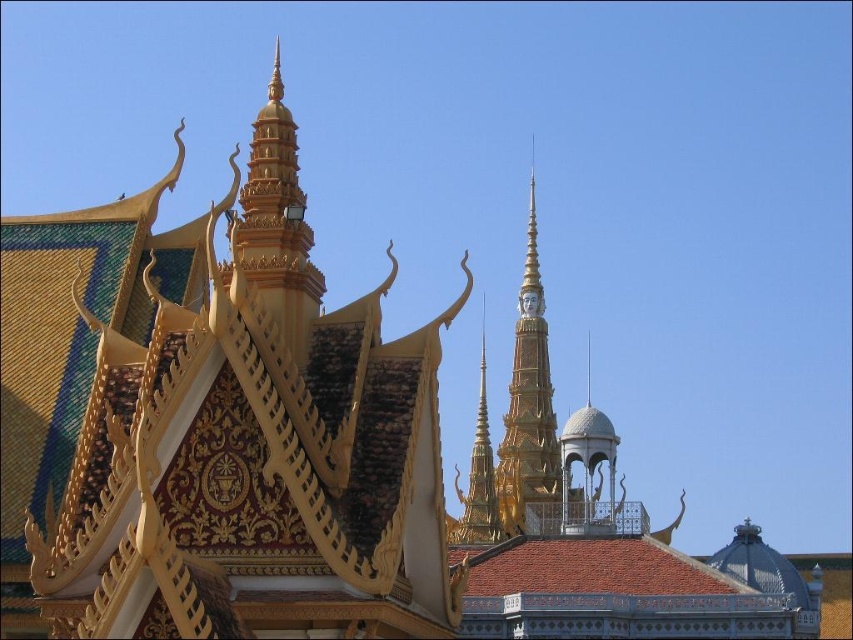
Question: Which is nearer to the gold/gilded spire at upper center?

Choices:
 (A) gold/gilded stupa at center
 (B) gold textured spire at center

Answer: (A)

Question: Where is gold/gilded spire at upper center located in relation to gold/gilded stupa at center in the image?

Choices:
 (A) left
 (B) right

Answer: (A)

Question: Among these points, which one is nearest to the camera?

Choices:
 (A) (305, 241)
 (B) (477, 529)
 (C) (548, 422)

Answer: (A)

Question: Which of the following is the farthest from the observer?

Choices:
 (A) (451, 538)
 (B) (273, 109)
 (C) (532, 465)

Answer: (C)

Question: Can you confirm if gold/gilded spire at upper center is thinner than gold textured spire at center?

Choices:
 (A) yes
 (B) no

Answer: (B)

Question: Can you confirm if gold/gilded stupa at center is bigger than gold textured spire at center?

Choices:
 (A) yes
 (B) no

Answer: (A)